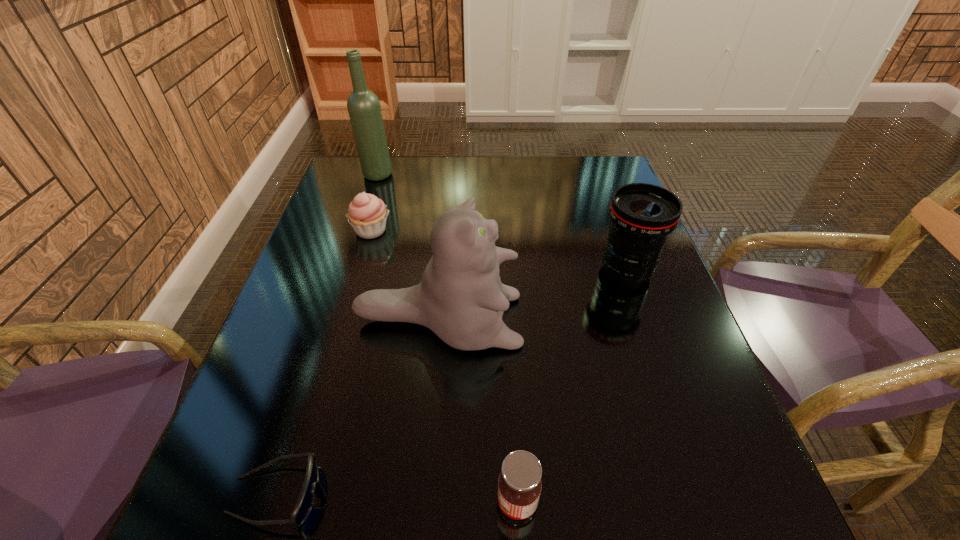
Locate which object is the fifth closest to the second tallest object. Please provide its 2D coordinates. Your answer should be formatted as a tuple, i.e. [(x, y)], where the tuple contains the x and y coordinates of a point satisfying the conditions above.

[(364, 109)]

The width and height of the screenshot is (960, 540). Identify the location of object that is the fifth closest one to the jam. (364, 109).

The height and width of the screenshot is (540, 960). In order to click on vacant point that satisfies the following two spatial constraints: 1. on the front side of the telephoto lens; 2. on the label side of the jam in this screenshot , I will do `click(707, 502)`.